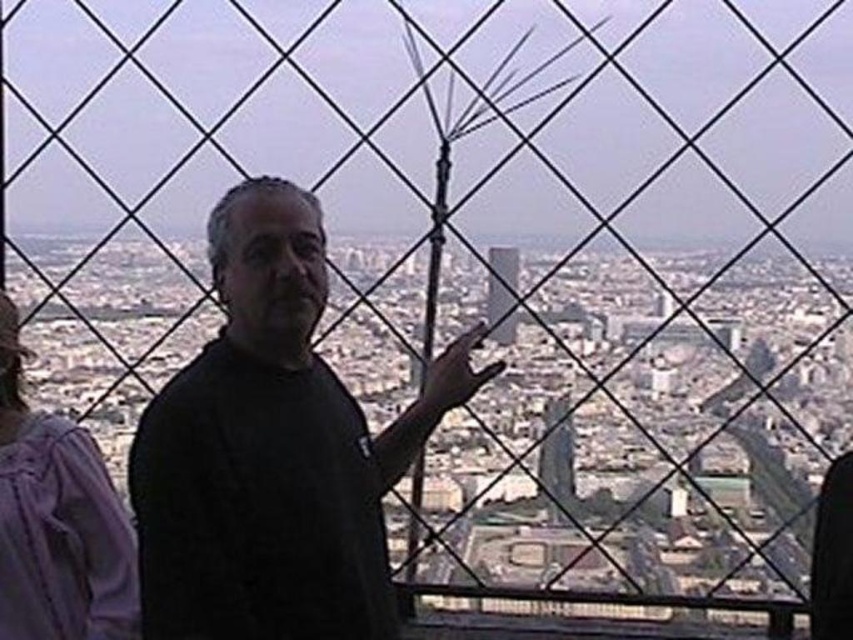
Is point (548, 442) closer to camera compared to point (511, 269)?

That is False.

Does smooth glass skyscraper at center have a smaller size compared to glassy reflective skyscraper at center?

No.

Is point (572, 438) positioned behind point (490, 291)?

Yes.

This screenshot has height=640, width=853. I want to click on smooth glass skyscraper at center, so click(x=556, y=449).

What do you see at coordinates (271, 451) in the screenshot? The height and width of the screenshot is (640, 853). I see `black matte shirt at center` at bounding box center [271, 451].

Is point (193, 600) more distant than point (567, 480)?

No, (193, 600) is closer to viewer.

Find the location of a particular element. The height and width of the screenshot is (640, 853). black matte shirt at center is located at coordinates (271, 451).

Locate an element on the screen. This screenshot has width=853, height=640. black matte shirt at center is located at coordinates (271, 451).

Is purple cotton hoodie at left smaller than smooth glass skyscraper at center?

No, purple cotton hoodie at left is not smaller than smooth glass skyscraper at center.

Which of these two, purple cotton hoodie at left or smooth glass skyscraper at center, stands shorter?

smooth glass skyscraper at center is shorter.

Where is `purple cotton hoodie at left`? Image resolution: width=853 pixels, height=640 pixels. purple cotton hoodie at left is located at coordinates (57, 520).

You are a GUI agent. You are given a task and a screenshot of the screen. Output one action in this format:
    pyautogui.click(x=<x>, y=<y>)
    Task: Click on the purple cotton hoodie at left
    This screenshot has height=640, width=853.
    Given the screenshot: What is the action you would take?
    pyautogui.click(x=57, y=520)